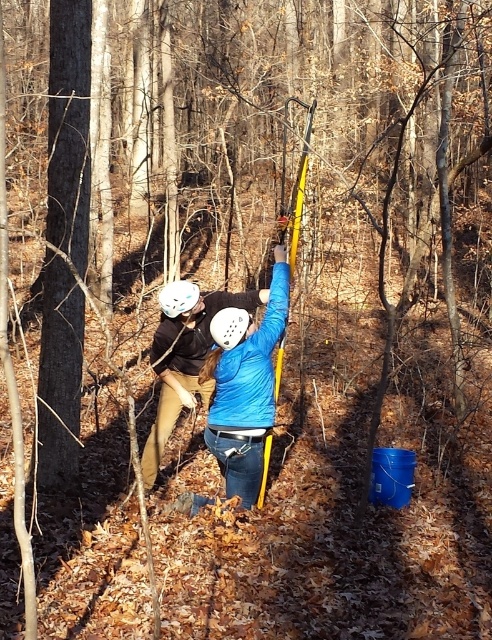
You are navigating a forest path and need to avoid obstacles. There is a white matte helmet at center. Based on its position, can you estimate if it is placed on the ground or worn by someone?

The white matte helmet at center is located at point (228, 326), which typically corresponds to the central area of the image. In the scene description, the person wearing the helmet is actively working and holding a tool, indicating the helmet is likely worn on their head for safety, not placed on the ground.

You are a safety inspector assessing the distance between the blue matte jacket at center and the white matte helmet at upper center. According to safety regulations, the minimum safe distance between a worker and their helmet must be at least 60 centimeters to ensure proper head protection. Is the current distance compliant with the regulation?

The distance between the blue matte jacket at center and the white matte helmet at upper center is 61.75 centimeters, which exceeds the minimum required 60 centimeters. Therefore, the current distance complies with the safety regulation.